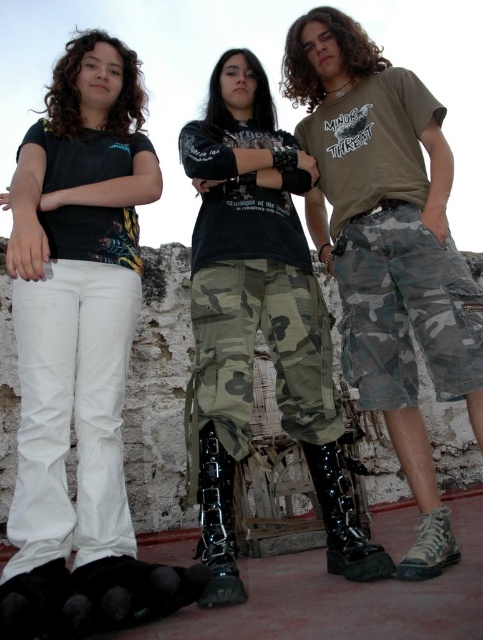
You are taking a photo of the three people. You want to focus on the camo fabric pants at center. Which person should you aim the camera at?

The camo fabric pants at center are worn by the individual in the middle, so you should aim the camera at the person in the middle.